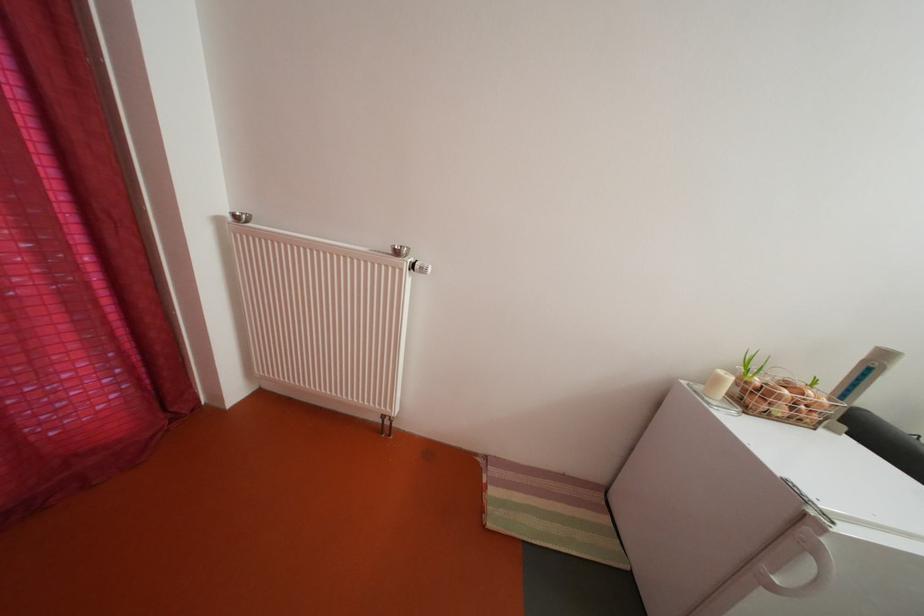
Where would you pull the white fridge handle? Please return your answer as a coordinate pair (x, y).

(803, 568)